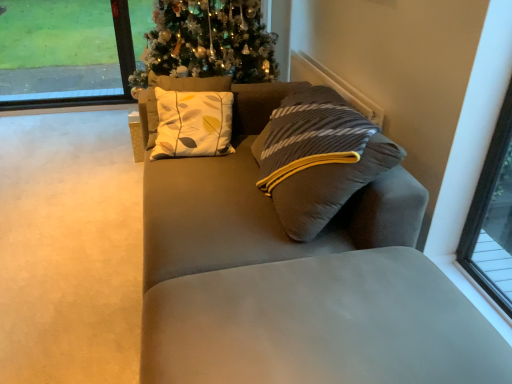
Question: Based on their sizes in the image, would you say beige carpet at lower left is bigger or smaller than transparent glass window at upper left?

Choices:
 (A) small
 (B) big

Answer: (B)

Question: Considering the positions of beige carpet at lower left and transparent glass window at upper left in the image, is beige carpet at lower left wider or thinner than transparent glass window at upper left?

Choices:
 (A) wide
 (B) thin

Answer: (A)

Question: Based on their relative distances, which object is nearer to the suede gray couch at center?

Choices:
 (A) transparent glass window at upper left
 (B) beige carpet at lower left

Answer: (B)

Question: Which is nearer to the beige carpet at lower left?

Choices:
 (A) transparent glass window at upper left
 (B) suede gray couch at center

Answer: (B)